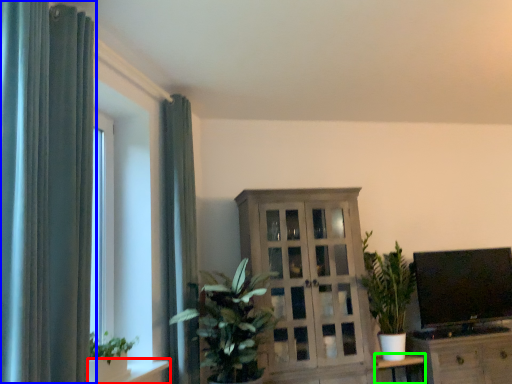
Question: Which object is positioned closest to shelf (highlighted by a red box)? Select from curtain (highlighted by a blue box) and table (highlighted by a green box).

Choices:
 (A) curtain
 (B) table

Answer: (A)